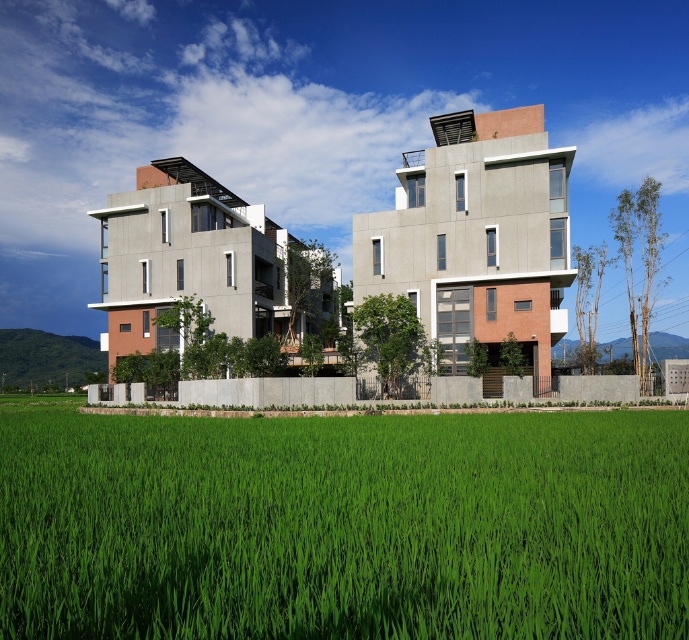
You are standing at the base of the green grassy hillside at center and want to walk to the green grass at lower center. In which direction should you head relative to the hillside?

You should head to the right side of the green grassy hillside at center to reach the green grass at lower center, as it is positioned on the right side of the hillside.

You are standing at the entrance of the modern architectural structure and want to take a photo. You notice two points marked in the scene. The first point is at coordinate point(x=486, y=444) and the second is at point(x=3, y=336). Which point will appear larger in your photo?

Point(x=486, y=444) is closer to the camera than point(x=3, y=336), so it will appear larger in the photo.